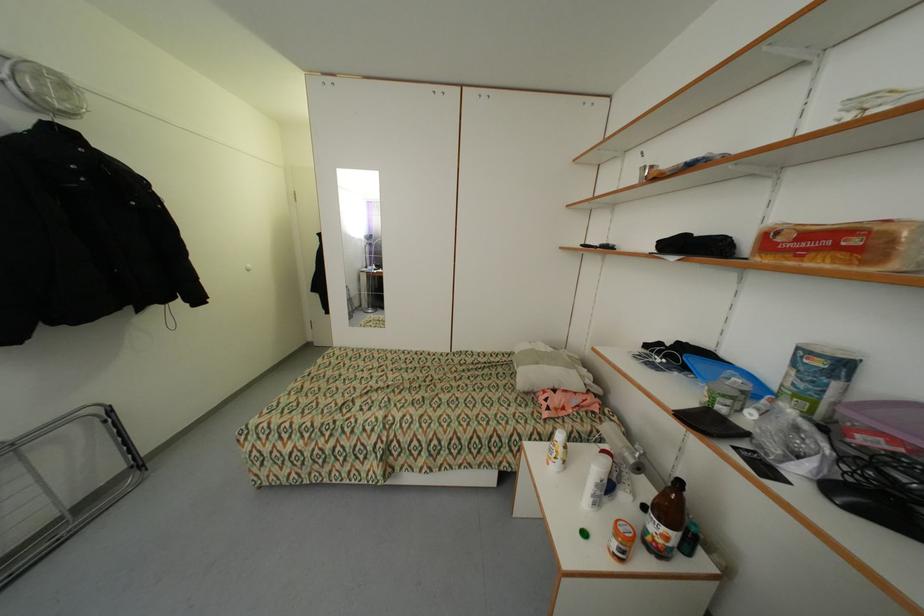
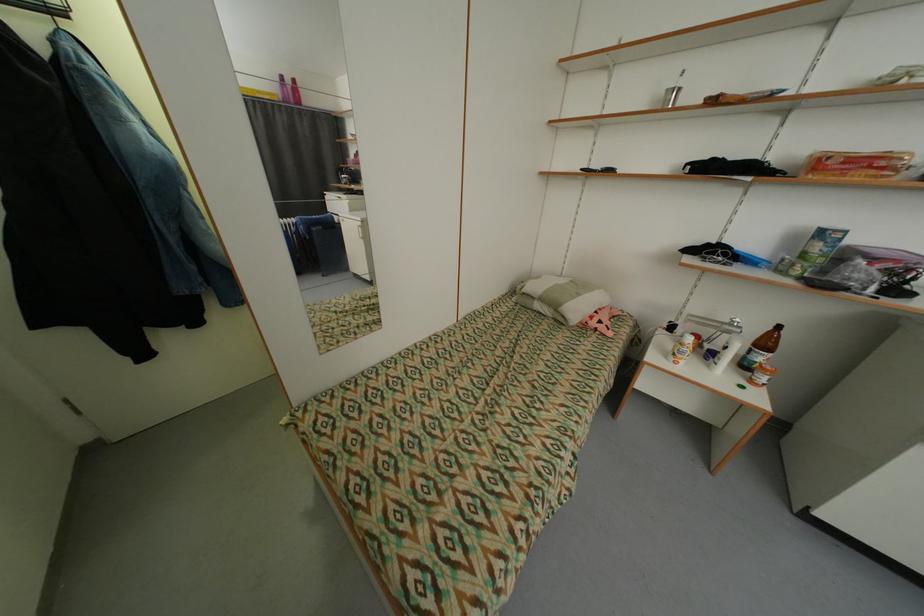
In the second image, find the point that corresponds to [548,400] in the first image.

(600, 323)